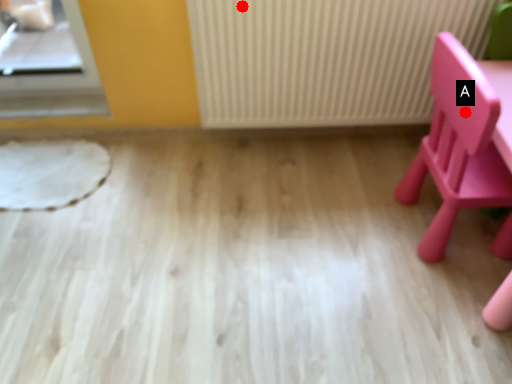
Question: Two points are circled on the image, labeled by A and B beside each circle. Which point is closer to the camera taking this photo?

Choices:
 (A) A is closer
 (B) B is closer

Answer: (A)